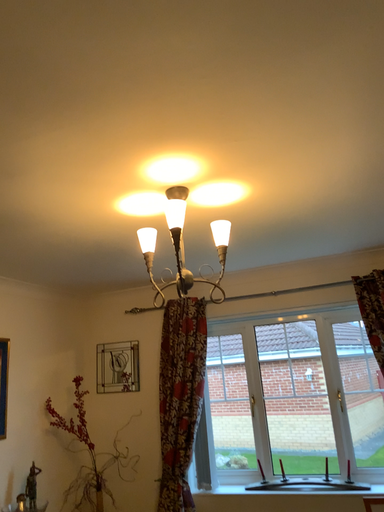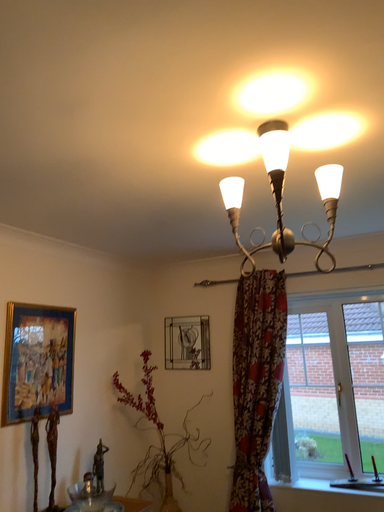
Question: How did the camera likely rotate when shooting the video?

Choices:
 (A) rotated left
 (B) rotated right

Answer: (A)